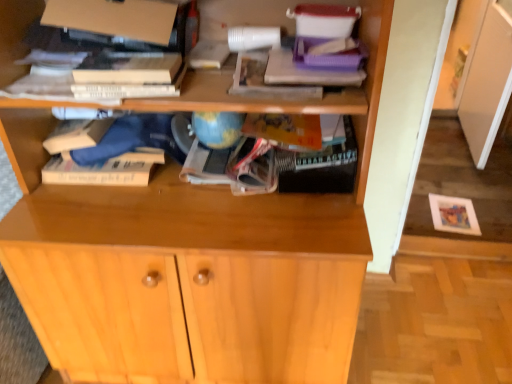
At what (x,y) coordinates should I click in order to perform the action: click on light wood cabinet at center. Please return your answer as a coordinate pair (x, y). Looking at the image, I should click on (196, 317).

What do you see at coordinates (196, 317) in the screenshot?
I see `light wood cabinet at center` at bounding box center [196, 317].

The image size is (512, 384). What do you see at coordinates (128, 68) in the screenshot?
I see `hardcover book at upper center` at bounding box center [128, 68].

Measure the distance between hardcover book at upper center and camera.

hardcover book at upper center and camera are 37.86 inches apart from each other.

You are a GUI agent. You are given a task and a screenshot of the screen. Output one action in this format:
    pyautogui.click(x=<x>, y=<y>)
    Task: Click on the hardcover book at upper center
    
    Given the screenshot: What is the action you would take?
    pyautogui.click(x=128, y=68)

Locate an element on the screen. The width and height of the screenshot is (512, 384). light wood cabinet at center is located at coordinates pos(196,317).

Can you confirm if hardcover book at upper center is positioned to the right of light wood cabinet at center?

Incorrect, hardcover book at upper center is not on the right side of light wood cabinet at center.

In the image, is hardcover book at upper center positioned in front of or behind light wood cabinet at center?

Visually, hardcover book at upper center is located in front of light wood cabinet at center.

Which point is more distant from viewer, (83, 79) or (334, 271)?

Point (83, 79)

From the image's perspective, does hardcover book at upper center appear lower than light wood cabinet at center?

No, from the image's perspective, hardcover book at upper center is not below light wood cabinet at center.

In the scene shown: From a real-world perspective, is hardcover book at upper center under light wood cabinet at center?

No.

Does hardcover book at upper center have a greater width compared to light wood cabinet at center?

No, hardcover book at upper center is not wider than light wood cabinet at center.

Is hardcover book at upper center taller than light wood cabinet at center?

Indeed, hardcover book at upper center has a greater height compared to light wood cabinet at center.

Looking at the image, does hardcover book at upper center seem bigger or smaller compared to light wood cabinet at center?

Clearly, hardcover book at upper center is smaller in size than light wood cabinet at center.

Is hardcover book at upper center inside or outside of light wood cabinet at center?

hardcover book at upper center is not inside light wood cabinet at center, it's outside.

Is hardcover book at upper center in contact with light wood cabinet at center?

hardcover book at upper center and light wood cabinet at center are clearly separated.

Could you tell me if hardcover book at upper center is turned towards light wood cabinet at center?

No, hardcover book at upper center is not facing towards light wood cabinet at center.

How many degrees apart are the facing directions of hardcover book at upper center and light wood cabinet at center?

The angular difference between hardcover book at upper center and light wood cabinet at center is 174 degrees.

At what (x,y) coordinates should I click in order to perform the action: click on paperback book above the light wood cabinet at center (from a real-world perspective). Please return your answer as a coordinate pair (x, y). Looking at the image, I should click on (128, 68).

Does light wood cabinet at center appear on the right side of hardcover book at upper center?

Yes.

Which is in front, light wood cabinet at center or hardcover book at upper center?

hardcover book at upper center is more forward.

Is point (44, 298) closer or farther from the camera than point (99, 80)?

Point (44, 298) is positioned farther from the camera compared to point (99, 80).

From the image's perspective, is light wood cabinet at center positioned above or below hardcover book at upper center?

Based on their image positions, light wood cabinet at center is located beneath hardcover book at upper center.

From a real-world perspective, does light wood cabinet at center stand above hardcover book at upper center?

Incorrect, from a real-world perspective, light wood cabinet at center is lower than hardcover book at upper center.

Does light wood cabinet at center have a greater width compared to hardcover book at upper center?

Yes, light wood cabinet at center is wider than hardcover book at upper center.

Can you confirm if light wood cabinet at center is taller than hardcover book at upper center?

No.

Between light wood cabinet at center and hardcover book at upper center, which one has larger size?

Bigger between the two is light wood cabinet at center.

Is light wood cabinet at center inside the boundaries of hardcover book at upper center, or outside?

light wood cabinet at center is not inside hardcover book at upper center, it's outside.

Are light wood cabinet at center and hardcover book at upper center far apart?

light wood cabinet at center is near hardcover book at upper center, not far away.

Is light wood cabinet at center facing away from hardcover book at upper center?

light wood cabinet at center does not have its back to hardcover book at upper center.

Identify the location of cabinetry on the right of the hardcover book at upper center. (196, 317).

The image size is (512, 384). In order to click on paperback book that is above the light wood cabinet at center (from the image's perspective) in this screenshot , I will do `click(128, 68)`.

Locate an element on the screen. This screenshot has width=512, height=384. cabinetry that is on the right side of hardcover book at upper center is located at coordinates (196, 317).